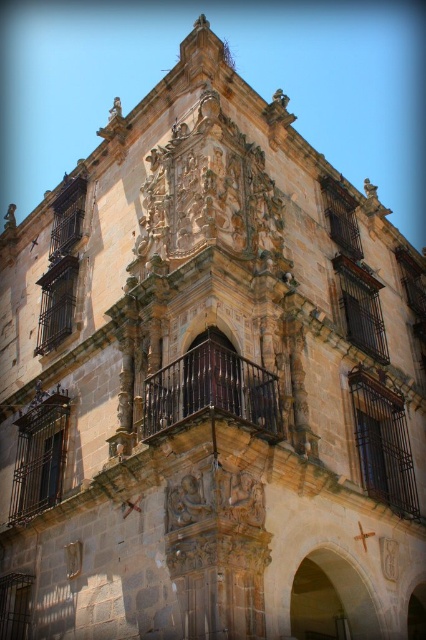
You are an architect analyzing the symmetry of the historic building. The dark brown wrought iron balcony at center is represented by point (210, 388). Is the balcony located closer to the top or bottom of the building?

The dark brown wrought iron balcony at center is represented by point (210, 388). Since the y coordinate is 0.495, which is nearly halfway between the bottom and top of the building, the balcony is approximately centered vertically and not closer to either the top or bottom.

You are an architect examining the historic building. You notice the dark brown wrought iron balcony at center and the white matte clock at center. From your perspective, which object is positioned to the left?

The dark brown wrought iron balcony at center is positioned to the left of the white matte clock at center.